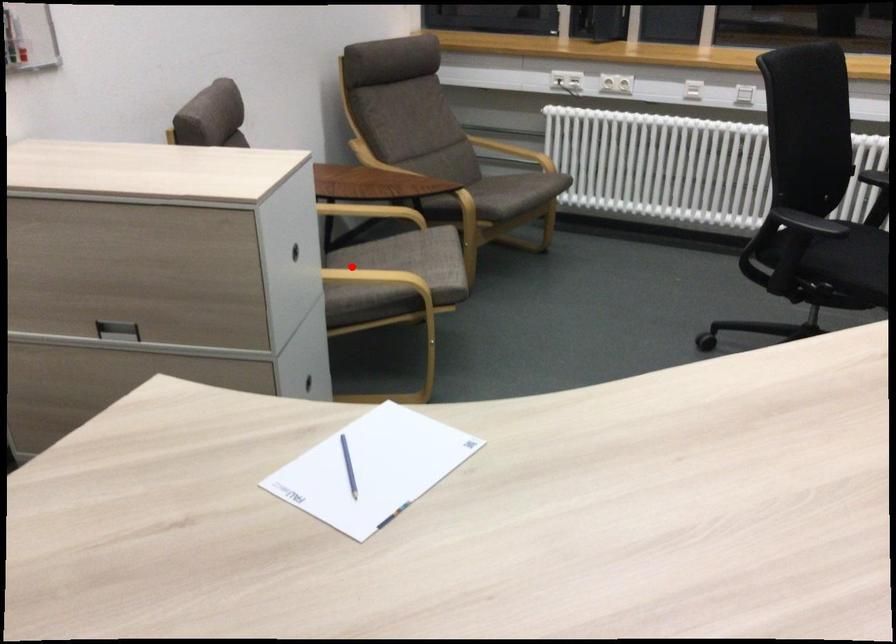
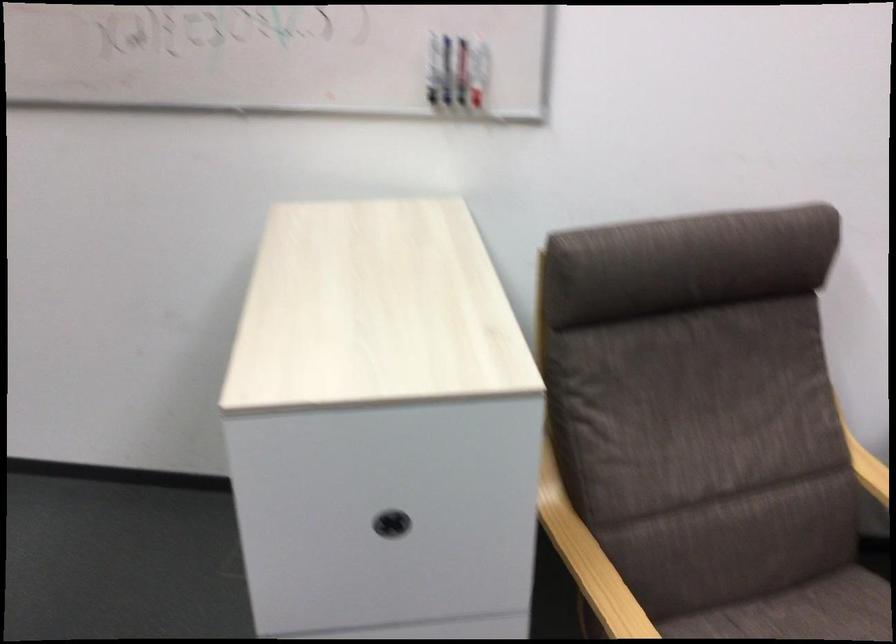
Question: A red point is marked in image1. In image2, is the corresponding 3D point closer to the camera or farther? Reply with the corresponding letter.

Choices:
 (A) The corresponding 3D point is closer.
 (B) The corresponding 3D point is farther.

Answer: (A)